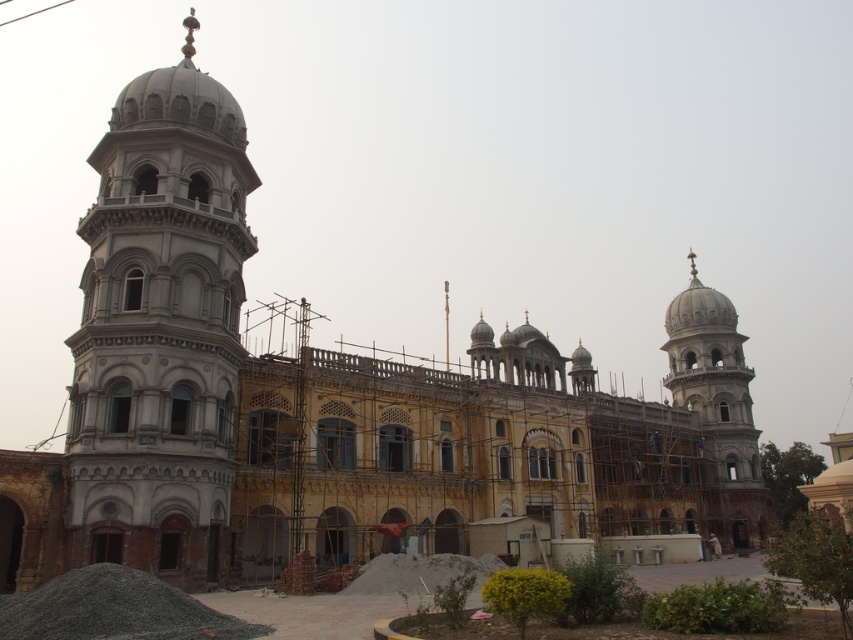
You are an architect inspecting the construction site of a grand building. You notice two towers, the white stone tower at left and the white marble tower at right. Based on their positions in the image, which tower appears higher in elevation?

The white stone tower at left appears higher in elevation since it is located above the white marble tower at right.

You are an architect planning to install a new decorative element between the white stone tower at left and the white marble tower at right. The element requires a minimum of 200 feet of space between them. Based on the scene description, will there be enough space for this installation?

The distance between the white stone tower at left and the white marble tower at right is 243.65 feet, which exceeds the required 200 feet. Therefore, there is sufficient space for the decorative element.